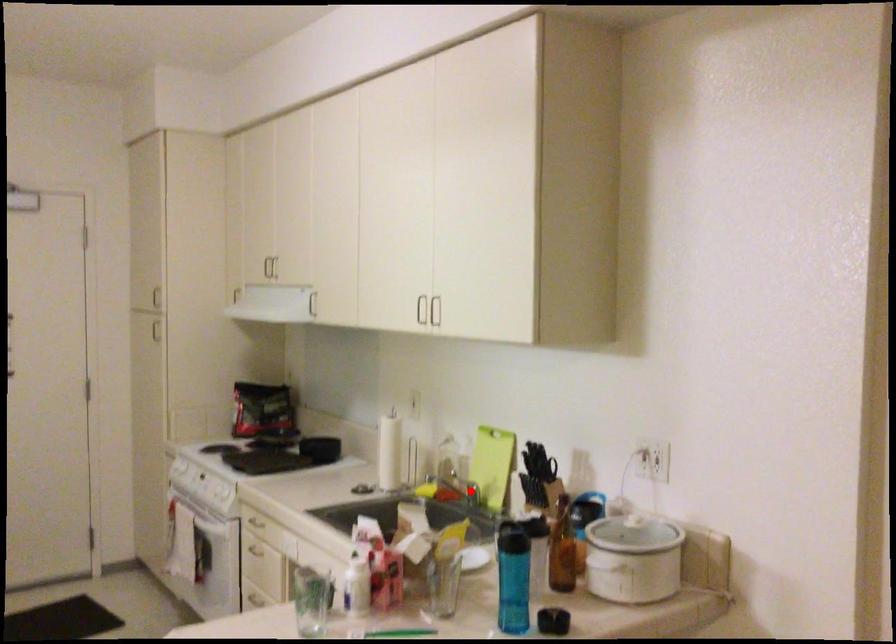
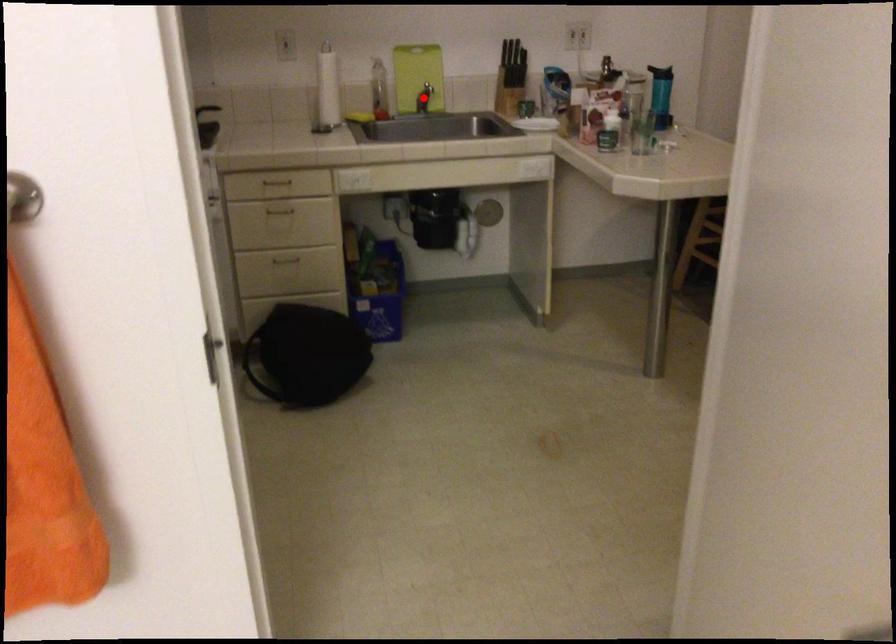
I am providing you with two images of the same scene from different viewpoints. A red point is marked on the first image and another point is marked on the second image. Do the highlighted points in image1 and image2 indicate the same real-world spot?

Yes